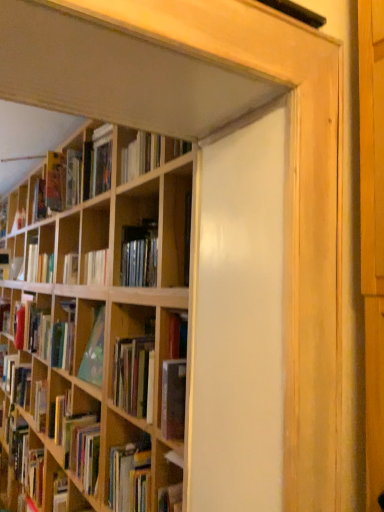
What is the approximate height of matte red book at left, the 1th book from the back?

It is 12.80 inches.

What do you see at coordinates (32, 329) in the screenshot? This screenshot has height=512, width=384. I see `matte red book at left, the 2th book viewed from the front` at bounding box center [32, 329].

Where is `matte red book at left, the 1th book from the back`? This screenshot has height=512, width=384. matte red book at left, the 1th book from the back is located at coordinates (32, 329).

What do you see at coordinates (75, 175) in the screenshot? The width and height of the screenshot is (384, 512). I see `hardcover book at upper left, which appears as the second book when viewed from the left` at bounding box center [75, 175].

Identify the location of hardcover book at upper left, positioned as the 2th book in bottom-to-top order. The image size is (384, 512). (75, 175).

I want to click on matte red book at left, the 2th book viewed from the front, so click(x=32, y=329).

Can you confirm if hardcover book at upper left, which appears as the second book when viewed from the left, is positioned to the left of matte red book at left, the 2th book viewed from the front?

No, hardcover book at upper left, which appears as the second book when viewed from the left, is not to the left of matte red book at left, the 2th book viewed from the front.

Relative to matte red book at left, the 1th book from the back, is hardcover book at upper left, the 1th book viewed from the top, in front or behind?

Visually, hardcover book at upper left, the 1th book viewed from the top, is located in front of matte red book at left, the 1th book from the back.

Is point (110, 140) farther from camera compared to point (33, 303)?

No, it is not.

From the image's perspective, does hardcover book at upper left, the 1th book in the front-to-back sequence, appear lower than matte red book at left, the second book positioned from the top?

No, from the image's perspective, hardcover book at upper left, the 1th book in the front-to-back sequence, is not below matte red book at left, the second book positioned from the top.

From a real-world perspective, who is located higher, hardcover book at upper left, positioned as the 2th book in bottom-to-top order, or matte red book at left, the first book from the left?

From a 3D spatial view, hardcover book at upper left, positioned as the 2th book in bottom-to-top order, is above.

Considering the relative sizes of hardcover book at upper left, positioned as the 2th book in bottom-to-top order, and matte red book at left, which is the 2th book from right to left, in the image provided, is hardcover book at upper left, positioned as the 2th book in bottom-to-top order, thinner than matte red book at left, which is the 2th book from right to left,?

No.

Between hardcover book at upper left, which is the first book in right-to-left order, and matte red book at left, the first book from the left, which one has more height?

With more height is hardcover book at upper left, which is the first book in right-to-left order.

Between hardcover book at upper left, positioned as the 2th book in bottom-to-top order, and matte red book at left, which is the 2th book from right to left, which one has larger size?

hardcover book at upper left, positioned as the 2th book in bottom-to-top order, is bigger.

From the picture: Do you think hardcover book at upper left, which is the first book in right-to-left order, is within matte red book at left, which ranks as the first book in bottom-to-top order, or outside of it?

The correct answer is: outside.

Is hardcover book at upper left, arranged as the 2th book when viewed from the back, far away from matte red book at left, the second book positioned from the top?

They are positioned close to each other.

Is matte red book at left, the 1th book from the back, at the back of hardcover book at upper left, the 1th book in the front-to-back sequence?

hardcover book at upper left, the 1th book in the front-to-back sequence, is not turned away from matte red book at left, the 1th book from the back.

How many degrees apart are the facing directions of hardcover book at upper left, the 1th book viewed from the top, and matte red book at left, which ranks as the first book in bottom-to-top order?

0.000898 degrees.

The height and width of the screenshot is (512, 384). In order to click on book on the left of hardcover book at upper left, positioned as the 2th book in bottom-to-top order in this screenshot , I will do `click(32, 329)`.

Can you confirm if matte red book at left, which ranks as the first book in bottom-to-top order, is positioned to the right of hardcover book at upper left, arranged as the 2th book when viewed from the back?

In fact, matte red book at left, which ranks as the first book in bottom-to-top order, is to the left of hardcover book at upper left, arranged as the 2th book when viewed from the back.

Is matte red book at left, the 2th book viewed from the front, in front of hardcover book at upper left, which is the first book in right-to-left order?

No, matte red book at left, the 2th book viewed from the front, is further to the viewer.

Is point (24, 305) more distant than point (75, 194)?

That is True.

From the image's perspective, is matte red book at left, the second book positioned from the top, on top of hardcover book at upper left, positioned as the 2th book in bottom-to-top order?

No, from the image's perspective, matte red book at left, the second book positioned from the top, is not over hardcover book at upper left, positioned as the 2th book in bottom-to-top order.

From a real-world perspective, is matte red book at left, the second book positioned from the top, over hardcover book at upper left, which is the first book in right-to-left order?

No.

Is matte red book at left, the second book positioned from the top, thinner than hardcover book at upper left, the 1th book viewed from the top?

Indeed, matte red book at left, the second book positioned from the top, has a lesser width compared to hardcover book at upper left, the 1th book viewed from the top.

Who is taller, matte red book at left, the 1th book from the back, or hardcover book at upper left, which is the first book in right-to-left order?

hardcover book at upper left, which is the first book in right-to-left order, is taller.

Considering the sizes of objects matte red book at left, the first book from the left, and hardcover book at upper left, the 1th book viewed from the top, in the image provided, who is bigger, matte red book at left, the first book from the left, or hardcover book at upper left, the 1th book viewed from the top,?

Bigger between the two is hardcover book at upper left, the 1th book viewed from the top.

Can we say matte red book at left, the second book positioned from the top, lies outside hardcover book at upper left, positioned as the 2th book in bottom-to-top order?

That's correct, matte red book at left, the second book positioned from the top, is outside of hardcover book at upper left, positioned as the 2th book in bottom-to-top order.

Is matte red book at left, the 2th book viewed from the front, far away from hardcover book at upper left, the 1th book viewed from the top?

No, matte red book at left, the 2th book viewed from the front, is in close proximity to hardcover book at upper left, the 1th book viewed from the top.

Is matte red book at left, the 1th book from the back, positioned with its back to hardcover book at upper left, which appears as the second book when viewed from the left?

No, matte red book at left, the 1th book from the back,'s orientation is not away from hardcover book at upper left, which appears as the second book when viewed from the left.

Can you tell me how much matte red book at left, the 1th book from the back, and hardcover book at upper left, the 1th book in the front-to-back sequence, differ in facing direction?

0.000898 degrees.

Image resolution: width=384 pixels, height=512 pixels. Identify the location of book located on the right of matte red book at left, the first book from the left. (75, 175).

Where is `book lying above the matte red book at left, the 1th book from the back (from the image's perspective)`? Image resolution: width=384 pixels, height=512 pixels. book lying above the matte red book at left, the 1th book from the back (from the image's perspective) is located at coordinates (75, 175).

You are a GUI agent. You are given a task and a screenshot of the screen. Output one action in this format:
    pyautogui.click(x=<x>, y=<y>)
    Task: Click on the book located on the left of hardcover book at upper left, which appears as the second book when viewed from the left
    Image resolution: width=384 pixels, height=512 pixels.
    Given the screenshot: What is the action you would take?
    pyautogui.click(x=32, y=329)